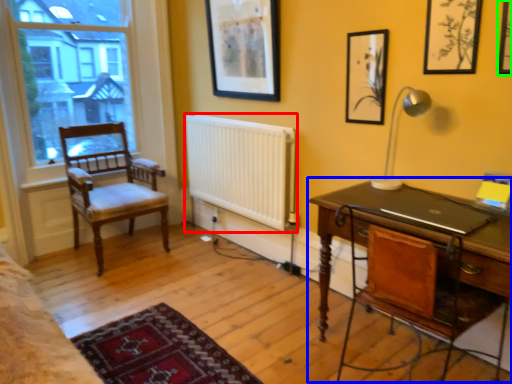
Question: Considering the real-world distances, which object is closest to radiator (highlighted by a red box)? desk (highlighted by a blue box) or picture frame (highlighted by a green box).

Choices:
 (A) desk
 (B) picture frame

Answer: (A)